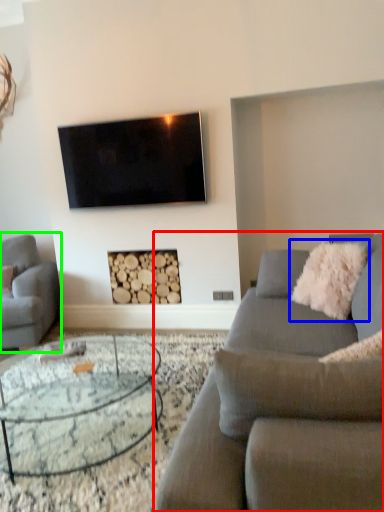
Question: Estimate the real-world distances between objects in this image. Which object is closer to studio couch (highlighted by a red box), pillow (highlighted by a blue box) or studio couch (highlighted by a green box)?

Choices:
 (A) pillow
 (B) studio couch

Answer: (A)